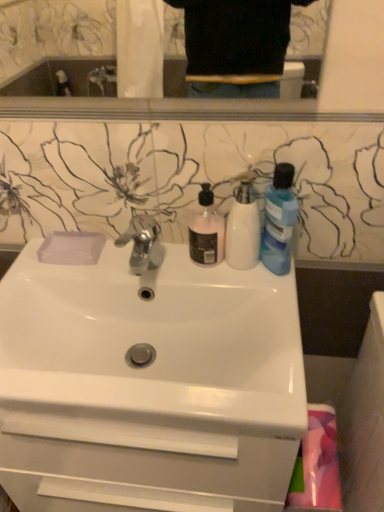
The image size is (384, 512). In order to click on vacant area that is situated to the right of polished chrome faucet at center in this screenshot , I will do `click(207, 274)`.